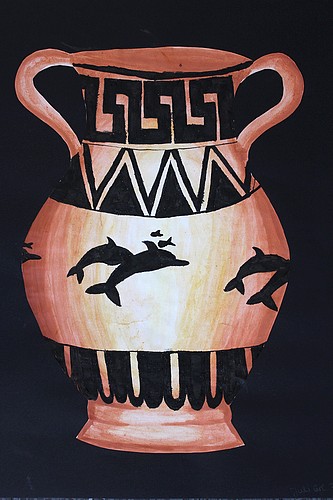
Identify the location of emptyspace below urn. (160, 470).